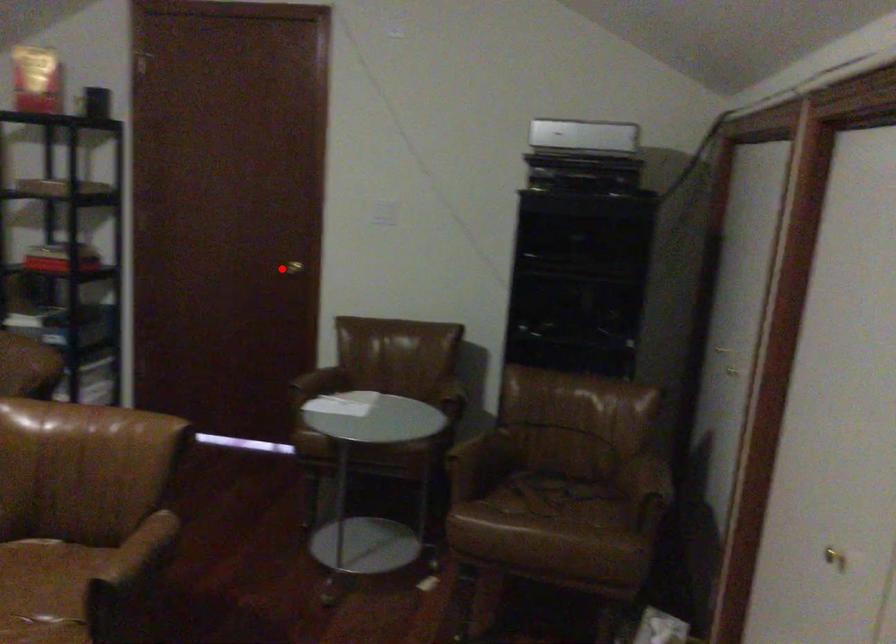
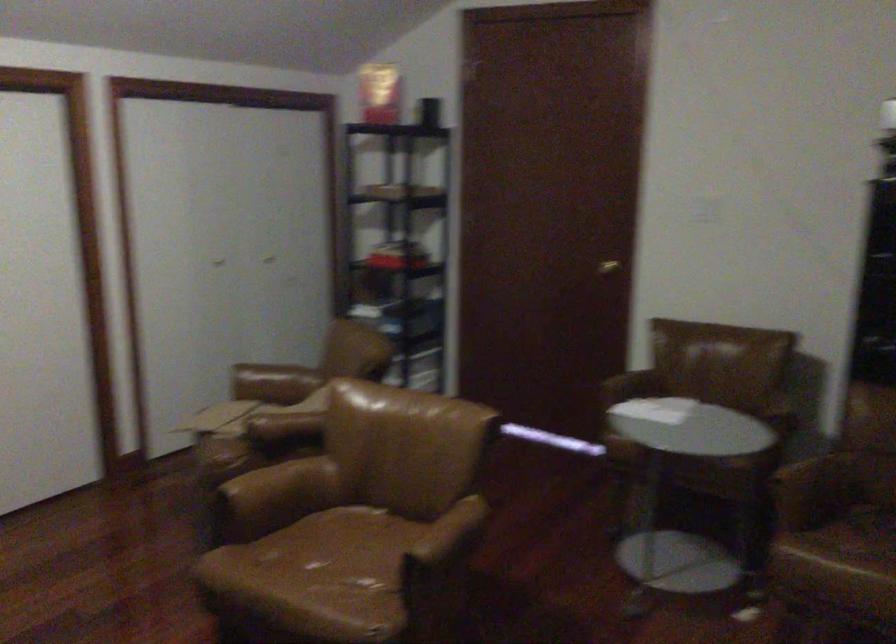
Where in the second image is the point corresponding to the highlighted location from the first image?

(607, 267)